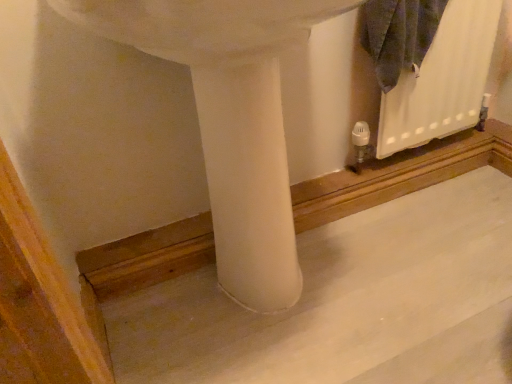
Identify the location of white matte radiator at upper right. This screenshot has width=512, height=384. (442, 80).

Describe the element at coordinates (230, 120) in the screenshot. I see `white matte sink at center` at that location.

This screenshot has height=384, width=512. What are the coordinates of `smooth concrete at center` in the screenshot? It's located at (346, 303).

Looking at this image, does white matte radiator at upper right have a greater width compared to smooth concrete at center?

No, white matte radiator at upper right is not wider than smooth concrete at center.

From the image's perspective, which object appears higher, white matte radiator at upper right or smooth concrete at center?

From the image's view, white matte radiator at upper right is above.

Does point (421, 142) appear closer or farther from the camera than point (486, 374)?

Point (421, 142).

Is white matte radiator at upper right to the right of white matte sink at center from the viewer's perspective?

Indeed, white matte radiator at upper right is positioned on the right side of white matte sink at center.

Could you tell me if white matte radiator at upper right is facing white matte sink at center?

No.

In terms of size, does white matte radiator at upper right appear bigger or smaller than white matte sink at center?

Clearly, white matte radiator at upper right is smaller in size than white matte sink at center.

Which of these two, smooth concrete at center or white matte sink at center, is wider?

smooth concrete at center.

Considering the points (357, 214) and (188, 36), which point is behind, point (357, 214) or point (188, 36)?

The point (357, 214) is farther from the camera.

From a real-world perspective, is smooth concrete at center beneath white matte sink at center?

Yes, from a real-world perspective, smooth concrete at center is under white matte sink at center.

Measure the distance from smooth concrete at center to white matte sink at center.

12.64 inches.

Considering the points (232, 288) and (470, 45), which point is behind, point (232, 288) or point (470, 45)?

The point (470, 45) is behind.

Is white matte radiator at upper right at the back of white matte sink at center?

No, white matte radiator at upper right is not at the back of white matte sink at center.

Which object is wider, white matte sink at center or white matte radiator at upper right?

With larger width is white matte sink at center.

Does white matte sink at center have a lesser height compared to white matte radiator at upper right?

In fact, white matte sink at center may be taller than white matte radiator at upper right.

Looking at their sizes, would you say white matte sink at center is wider or thinner than smooth concrete at center?

Clearly, white matte sink at center has less width compared to smooth concrete at center.

I want to click on sink lying in front of the smooth concrete at center, so [230, 120].

Considering the relative sizes of white matte sink at center and smooth concrete at center in the image provided, is white matte sink at center shorter than smooth concrete at center?

No, white matte sink at center is not shorter than smooth concrete at center.

Where is `radiator behind the smooth concrete at center`? The height and width of the screenshot is (384, 512). radiator behind the smooth concrete at center is located at coordinates click(x=442, y=80).

Which of these two, smooth concrete at center or white matte radiator at upper right, is wider?

smooth concrete at center.

Which is more to the left, smooth concrete at center or white matte radiator at upper right?

Positioned to the left is smooth concrete at center.

From the image's perspective, which is below, smooth concrete at center or white matte radiator at upper right?

smooth concrete at center.

The width and height of the screenshot is (512, 384). I want to click on concrete below the white matte radiator at upper right (from a real-world perspective), so click(x=346, y=303).

You are a GUI agent. You are given a task and a screenshot of the screen. Output one action in this format:
    pyautogui.click(x=<x>, y=<y>)
    Task: Click on the sink that appears on the left of white matte radiator at upper right
    
    Given the screenshot: What is the action you would take?
    pyautogui.click(x=230, y=120)

From the image, which object appears to be farther from smooth concrete at center, white matte radiator at upper right or white matte sink at center?

Among the two, white matte radiator at upper right is located further to smooth concrete at center.

When comparing their distances from smooth concrete at center, does white matte sink at center or white matte radiator at upper right seem further?

white matte radiator at upper right lies further to smooth concrete at center than the other object.

Based on the photo, based on their spatial positions, is white matte radiator at upper right or smooth concrete at center closer to white matte sink at center?

Among the two, smooth concrete at center is located nearer to white matte sink at center.

From the image, which object appears to be farther from white matte sink at center, smooth concrete at center or white matte radiator at upper right?

white matte radiator at upper right.

From the picture: Looking at the image, which one is located closer to white matte radiator at upper right, white matte sink at center or smooth concrete at center?

smooth concrete at center is closer to white matte radiator at upper right.

Based on their spatial positions, is smooth concrete at center or white matte sink at center further from white matte radiator at upper right?

Among the two, white matte sink at center is located further to white matte radiator at upper right.

What are the coordinates of `concrete between white matte sink at center and white matte radiator at upper right along the z-axis` in the screenshot? It's located at (346, 303).